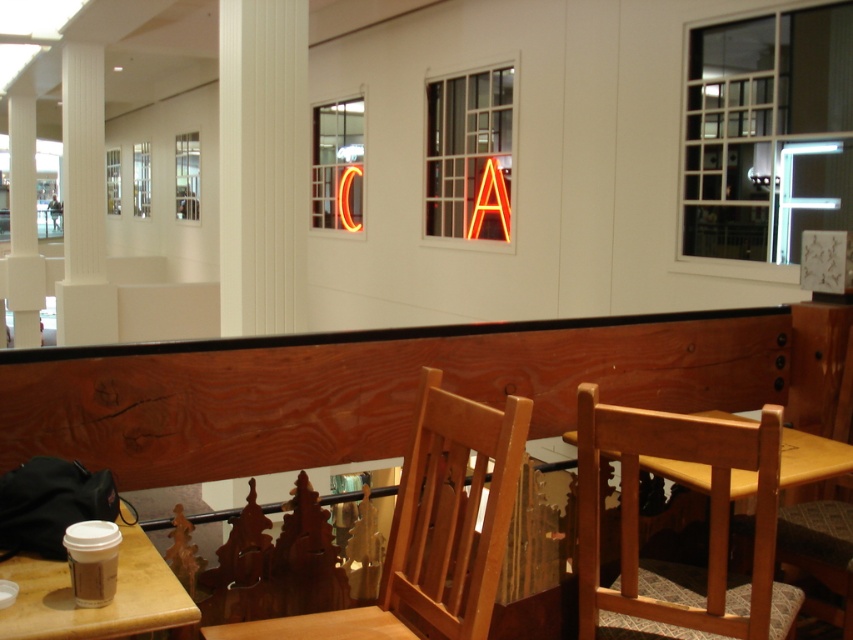
You are a customer at the cafe and want to place a large birthday cake on the table between the white smooth pillar at left and the neon orange letter a at center. The cake is 3 feet wide. Is there enough space between these two objects to place the cake?

The distance between the white smooth pillar at left and the neon orange letter a at center is 25.40 feet, which is more than enough to accommodate a 3 feet wide cake. Yes, there is sufficient space.

Looking at this image, you are sitting at a table in the seating area and want to place your coffee cup on the nearest object. Which object should you choose between the wooden chair at lower right and the white smooth pillar at left?

The wooden chair at lower right is closer to the viewer than the white smooth pillar at left, so you should place your coffee cup on the wooden chair at lower right.

From the picture: You are a customer trying to decide where to sit in the cafe. You want to choose a spot with more space. Which object should you choose between the wooden chair at lower right and the matte brown table at lower left?

The wooden chair at lower right has a greater width than the matte brown table at lower left, so you should choose the wooden chair at lower right for more space.